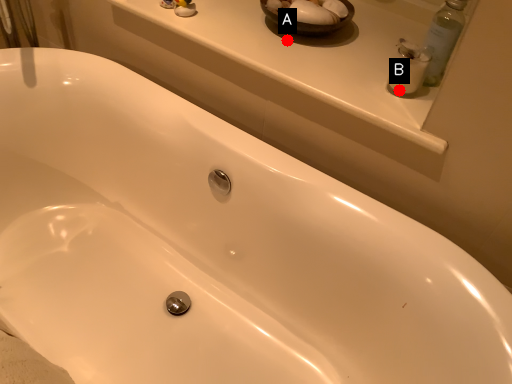
Question: Two points are circled on the image, labeled by A and B beside each circle. Which point is farther to the camera?

Choices:
 (A) A is further
 (B) B is further

Answer: (A)